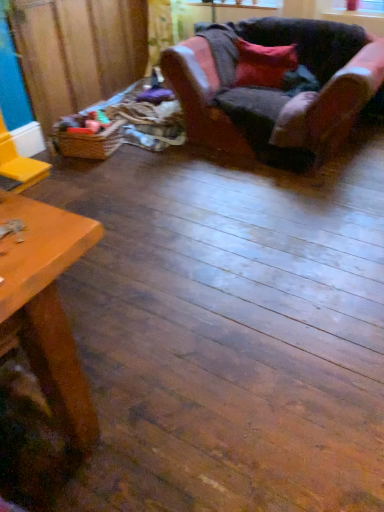
Question: From the image's perspective, is woven brown basket at left above transparent plastic window screen at upper center?

Choices:
 (A) yes
 (B) no

Answer: (B)

Question: Considering the relative positions of woven brown basket at left and transparent plastic window screen at upper center in the image provided, is woven brown basket at left to the right of transparent plastic window screen at upper center from the viewer's perspective?

Choices:
 (A) yes
 (B) no

Answer: (B)

Question: Is woven brown basket at left surrounding transparent plastic window screen at upper center?

Choices:
 (A) no
 (B) yes

Answer: (A)

Question: Would you consider woven brown basket at left to be distant from transparent plastic window screen at upper center?

Choices:
 (A) yes
 (B) no

Answer: (A)

Question: Considering the relative sizes of woven brown basket at left and transparent plastic window screen at upper center in the image provided, is woven brown basket at left bigger than transparent plastic window screen at upper center?

Choices:
 (A) no
 (B) yes

Answer: (B)

Question: Would you say woven brown basket at left is inside or outside velvet-like pink armchair at upper right?

Choices:
 (A) outside
 (B) inside

Answer: (A)

Question: Is point (89, 134) closer or farther from the camera than point (334, 130)?

Choices:
 (A) farther
 (B) closer

Answer: (A)

Question: From the image's perspective, is woven brown basket at left located above or below velvet-like pink armchair at upper right?

Choices:
 (A) below
 (B) above

Answer: (A)

Question: From a real-world perspective, is woven brown basket at left physically located above or below velvet-like pink armchair at upper right?

Choices:
 (A) above
 (B) below

Answer: (B)

Question: Is velvet-like pink armchair at upper right taller or shorter than brown woven basket at left?

Choices:
 (A) tall
 (B) short

Answer: (B)

Question: Considering the positions of velvet-like pink armchair at upper right and brown woven basket at left in the image, is velvet-like pink armchair at upper right bigger or smaller than brown woven basket at left?

Choices:
 (A) small
 (B) big

Answer: (B)

Question: From the image's perspective, is velvet-like pink armchair at upper right positioned above or below brown woven basket at left?

Choices:
 (A) above
 (B) below

Answer: (B)

Question: Based on their positions, is velvet-like pink armchair at upper right located to the left or right of brown woven basket at left?

Choices:
 (A) left
 (B) right

Answer: (B)

Question: Looking at the image, does velvet red pillow at upper right seem bigger or smaller compared to velvet-like pink armchair at upper right?

Choices:
 (A) big
 (B) small

Answer: (B)

Question: Based on their positions, is velvet red pillow at upper right located to the left or right of velvet-like pink armchair at upper right?

Choices:
 (A) right
 (B) left

Answer: (B)